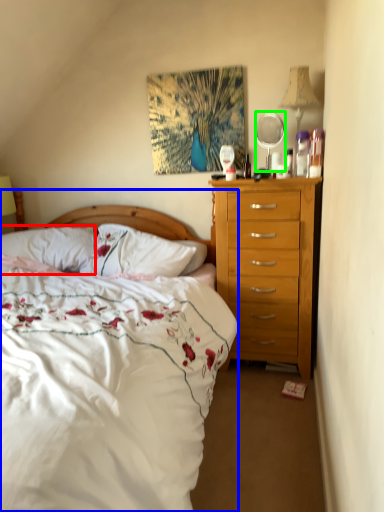
Question: Which object is positioned closest to pillow (highlighted by a red box)? Select from bed (highlighted by a blue box) and mirror (highlighted by a green box).

Choices:
 (A) bed
 (B) mirror

Answer: (A)